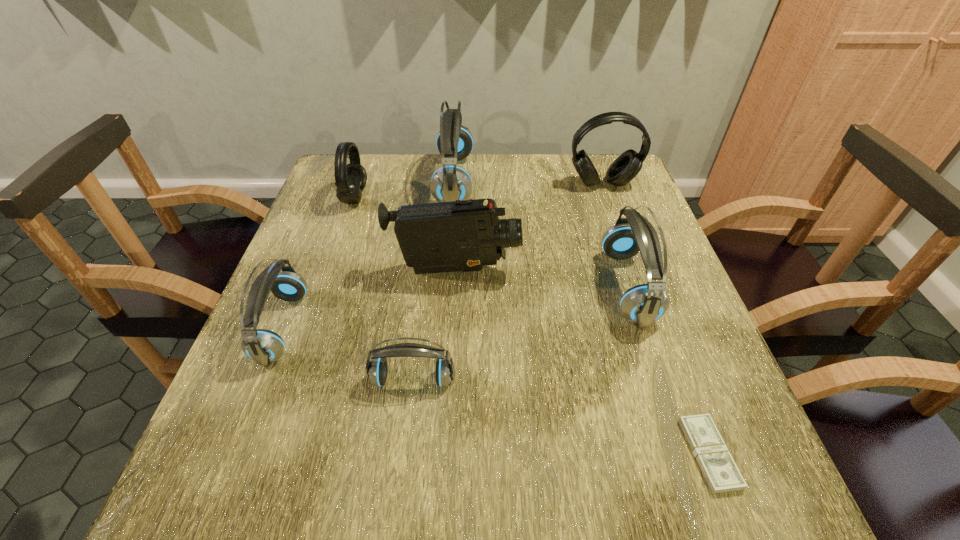
Identify the location of object positioned at the near edge. The width and height of the screenshot is (960, 540). (722, 475).

This screenshot has width=960, height=540. I want to click on money that is at the right edge, so click(722, 475).

At what (x,y) coordinates should I click in order to perform the action: click on object that is at the far left corner. Please return your answer as a coordinate pair (x, y). This screenshot has height=540, width=960. Looking at the image, I should click on (350, 179).

Where is `object at the far right corner`? object at the far right corner is located at coordinates (625, 167).

At what (x,y) coordinates should I click in order to perform the action: click on object positioned at the near right corner. Please return your answer as a coordinate pair (x, y). The image size is (960, 540). Looking at the image, I should click on (722, 475).

The image size is (960, 540). Identify the location of vacant space at the far edge of the desktop. (549, 192).

This screenshot has height=540, width=960. Find the location of `vacant space at the near edge of the desktop`. vacant space at the near edge of the desktop is located at coordinates (605, 460).

Image resolution: width=960 pixels, height=540 pixels. In order to click on vacant point at the left edge in this screenshot , I will do `click(294, 407)`.

At what (x,y) coordinates should I click in order to perform the action: click on free region at the right edge. Please return your answer as a coordinate pair (x, y). This screenshot has width=960, height=540. Looking at the image, I should click on (679, 292).

The image size is (960, 540). In the image, there is a desktop. Identify the location of vacant space at the far right corner. (599, 187).